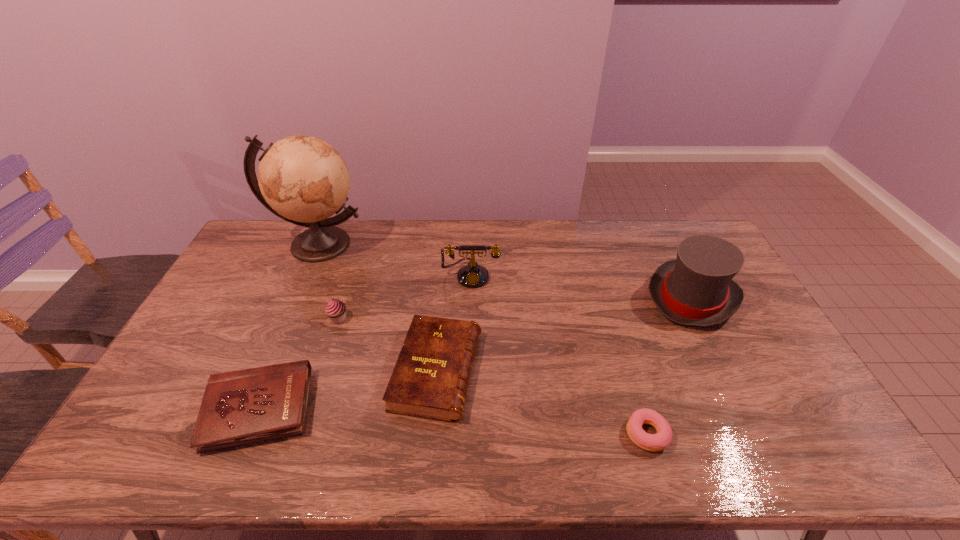
I want to click on the tallest object, so (x=303, y=180).

The height and width of the screenshot is (540, 960). Identify the location of dress hat. (696, 289).

Image resolution: width=960 pixels, height=540 pixels. Find the location of `the rightmost object`. the rightmost object is located at coordinates (696, 289).

Locate an element on the screen. the third tallest object is located at coordinates (472, 275).

Where is `the fourth shortest object`? The width and height of the screenshot is (960, 540). the fourth shortest object is located at coordinates (335, 310).

Find the location of a particular element. The height and width of the screenshot is (540, 960). the right hardback book is located at coordinates (430, 379).

At what (x,y) coordinates should I click in order to perform the action: click on the left hardback book. Please return your answer as a coordinate pair (x, y). The height and width of the screenshot is (540, 960). Looking at the image, I should click on [246, 406].

Find the location of a particular element. Image resolution: width=960 pixels, height=540 pixels. the shortest object is located at coordinates (651, 442).

At what (x,y) coordinates should I click in order to perform the action: click on doughnut. Please return your answer as a coordinate pair (x, y). This screenshot has height=540, width=960. Looking at the image, I should click on (651, 442).

This screenshot has width=960, height=540. I want to click on vacant position located on the front-facing side of the tallest object, so click(273, 350).